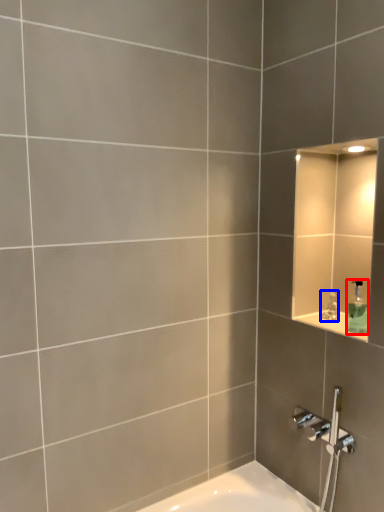
Question: Among these objects, which one is farthest to the camera, soap dispenser (highlighted by a red box) or faucet (highlighted by a blue box)?

Choices:
 (A) soap dispenser
 (B) faucet

Answer: (B)